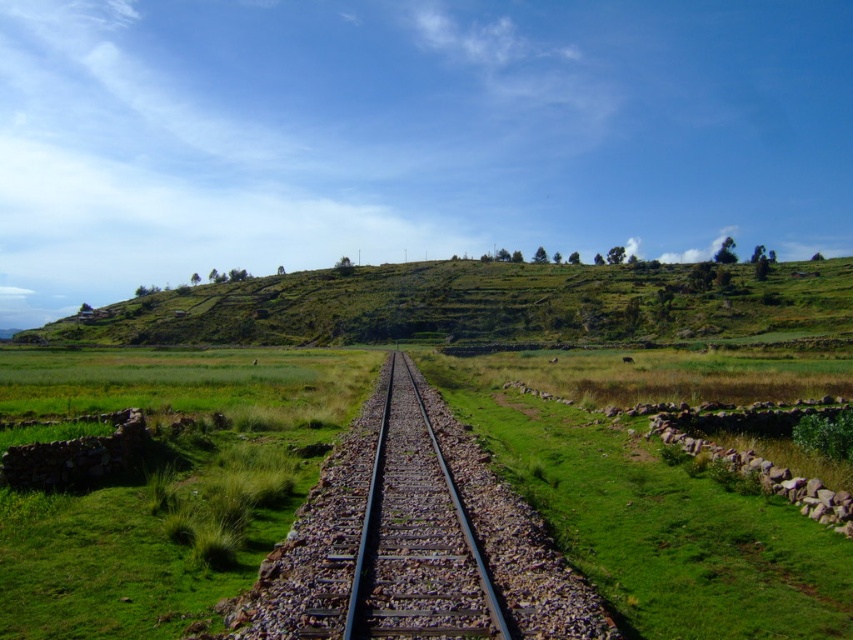
You are a hiker standing at the point marked by the coordinates point (x=474, y=305). Looking around, you see the green grassy hillside at center. Which direction should you face to see the railway track that runs parallel to the stone wall on the right side?

The point (x=474, y=305) marks the green grassy hillside at center. Since the railway track is bordered by grassy areas on both sides and the stone wall is on the right side of the track, you should face towards the railway track which is adjacent to the grassy hillside. Therefore, facing towards the railway track would allow you to see it running parallel to the stone wall on its right side.